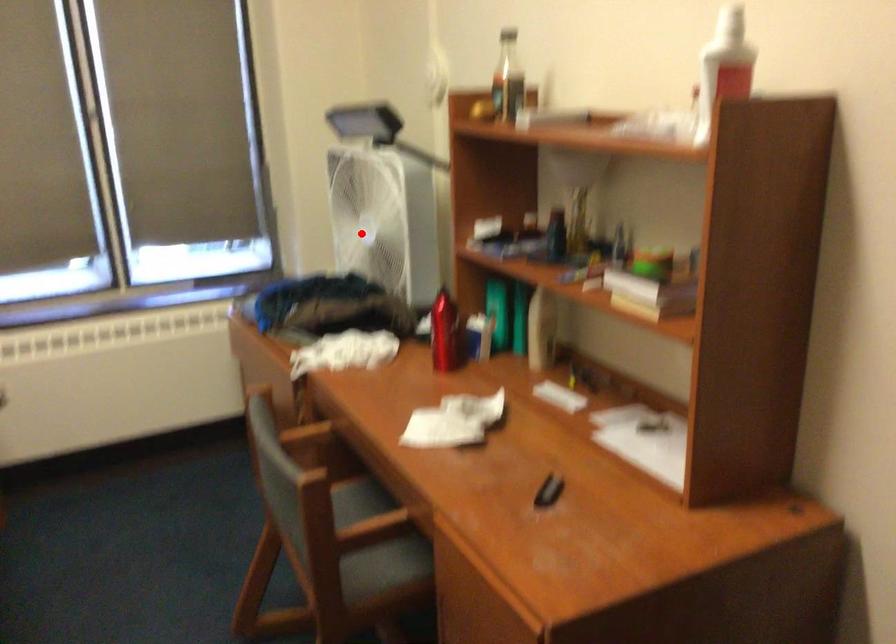
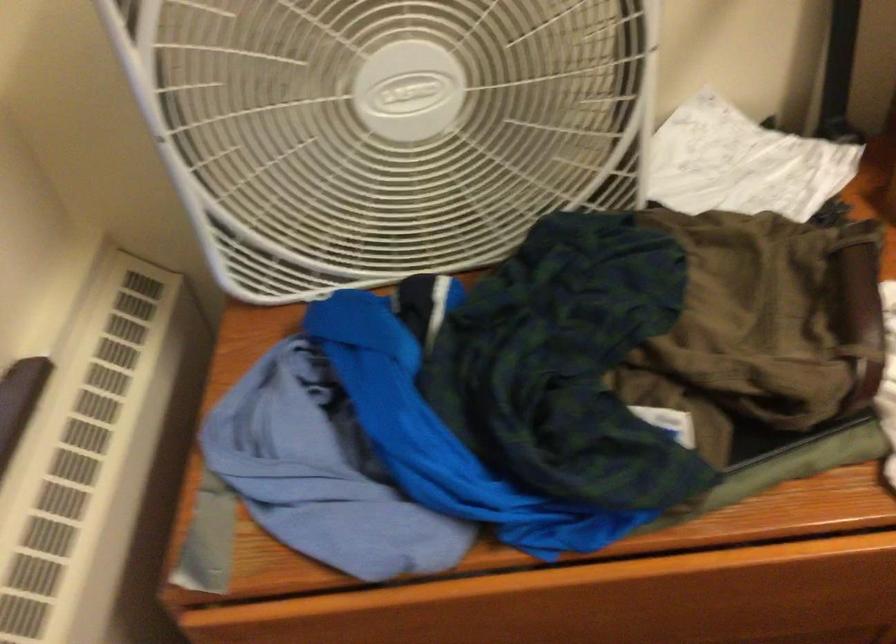
Question: I am providing you with two images of the same scene from different viewpoints. In image1, a red point is highlighted. Considering the same 3D point in image2, which of the following is correct?

Choices:
 (A) It is closer
 (B) It is farther

Answer: (A)